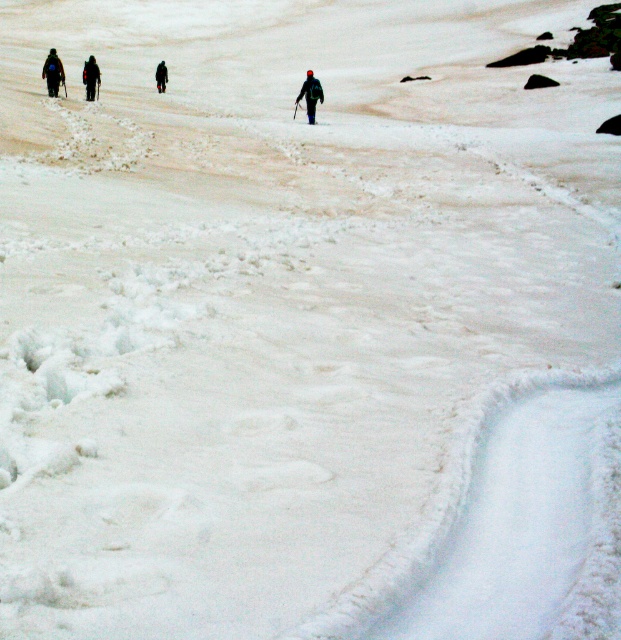
You are a photographer standing in the snowy landscape. You want to take a photo that includes both the dark blue jacket at left and the dark blue jacket at center. Which jacket should you adjust your camera angle to focus on first if you want to capture both in the frame?

The dark blue jacket at left is located above the dark blue jacket at center. To capture both in the frame, you should focus on the dark blue jacket at left first as it is higher up, allowing you to adjust the camera angle downward to include the one below.